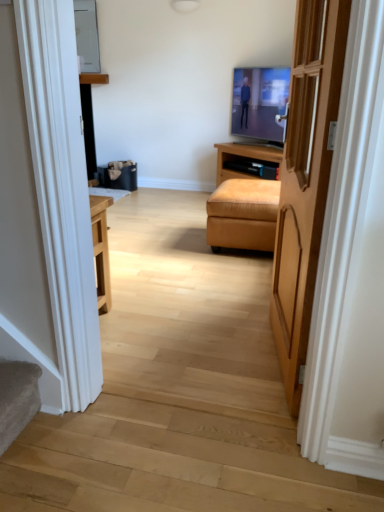
The width and height of the screenshot is (384, 512). I want to click on free space that is to the left of light brown wooden door at center, so click(x=201, y=347).